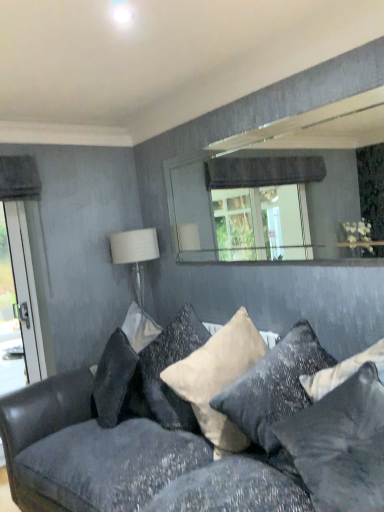
Question: Is velvet dark gray couch at lower center turned away from beige velvet pillow at center, which appears as the second pillow when viewed from the front?

Choices:
 (A) yes
 (B) no

Answer: (B)

Question: Does velvet dark gray couch at lower center have a greater width compared to beige velvet pillow at center, which is the 2th pillow in back-to-front order?

Choices:
 (A) no
 (B) yes

Answer: (B)

Question: Can you confirm if velvet dark gray couch at lower center is shorter than beige velvet pillow at center, which appears as the second pillow when viewed from the front?

Choices:
 (A) yes
 (B) no

Answer: (B)

Question: From the image's perspective, is velvet dark gray couch at lower center under beige velvet pillow at center, which appears as the second pillow when viewed from the front?

Choices:
 (A) no
 (B) yes

Answer: (B)

Question: Is the surface of velvet dark gray couch at lower center in direct contact with beige velvet pillow at center, which appears as the second pillow when viewed from the front?

Choices:
 (A) no
 (B) yes

Answer: (A)

Question: Is velvet dark gray couch at lower center positioned before beige velvet pillow at center, which appears as the second pillow when viewed from the front?

Choices:
 (A) no
 (B) yes

Answer: (B)

Question: Considering the relative positions of white velvet pillow at center, which is the first pillow from back to front, and beige velvet pillow at center, which is the 2th pillow in back-to-front order, in the image provided, is white velvet pillow at center, which is the first pillow from back to front, to the right of beige velvet pillow at center, which is the 2th pillow in back-to-front order, from the viewer's perspective?

Choices:
 (A) no
 (B) yes

Answer: (A)

Question: Can you confirm if white velvet pillow at center, which is the first pillow from back to front, is wider than beige velvet pillow at center, which is the 2th pillow in back-to-front order?

Choices:
 (A) no
 (B) yes

Answer: (A)

Question: Is white velvet pillow at center, which is the third pillow in front-to-back order, surrounding beige velvet pillow at center, which is the 2th pillow in back-to-front order?

Choices:
 (A) no
 (B) yes

Answer: (A)

Question: Is white velvet pillow at center, which is the third pillow in front-to-back order, outside beige velvet pillow at center, which is the 2th pillow in back-to-front order?

Choices:
 (A) no
 (B) yes

Answer: (A)

Question: Is white velvet pillow at center, which is the third pillow in front-to-back order, facing away from beige velvet pillow at center, which is the 2th pillow in back-to-front order?

Choices:
 (A) yes
 (B) no

Answer: (B)

Question: Is white velvet pillow at center, which is the third pillow in front-to-back order, further to camera compared to beige velvet pillow at center, which appears as the second pillow when viewed from the front?

Choices:
 (A) yes
 (B) no

Answer: (A)

Question: From the image's perspective, is beige velvet pillow at center, which is the 2th pillow in back-to-front order, over white fabric lampshade at upper right?

Choices:
 (A) yes
 (B) no

Answer: (B)